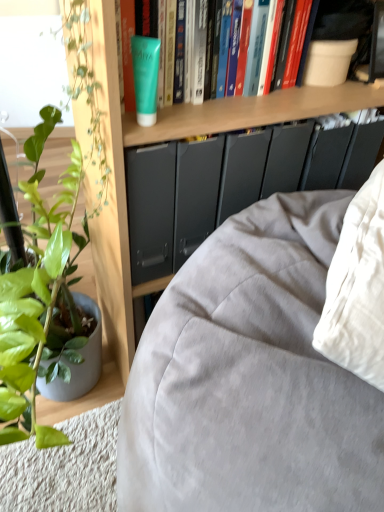
Question: Considering their positions, is wooden bookshelf at upper center located in front of or behind green matte tube at upper center?

Choices:
 (A) behind
 (B) front

Answer: (B)

Question: Is wooden bookshelf at upper center wider or thinner than green matte tube at upper center?

Choices:
 (A) wide
 (B) thin

Answer: (A)

Question: Based on their relative distances, which object is farther from the matte gray fabric couch at lower left?

Choices:
 (A) wooden bookshelf at upper center
 (B) green matte tube at upper center
 (C) green matte tube at upper center

Answer: (B)

Question: Which object is the closest to the green matte tube at upper center?

Choices:
 (A) green matte tube at upper center
 (B) wooden bookshelf at upper center
 (C) matte gray fabric couch at lower left

Answer: (A)